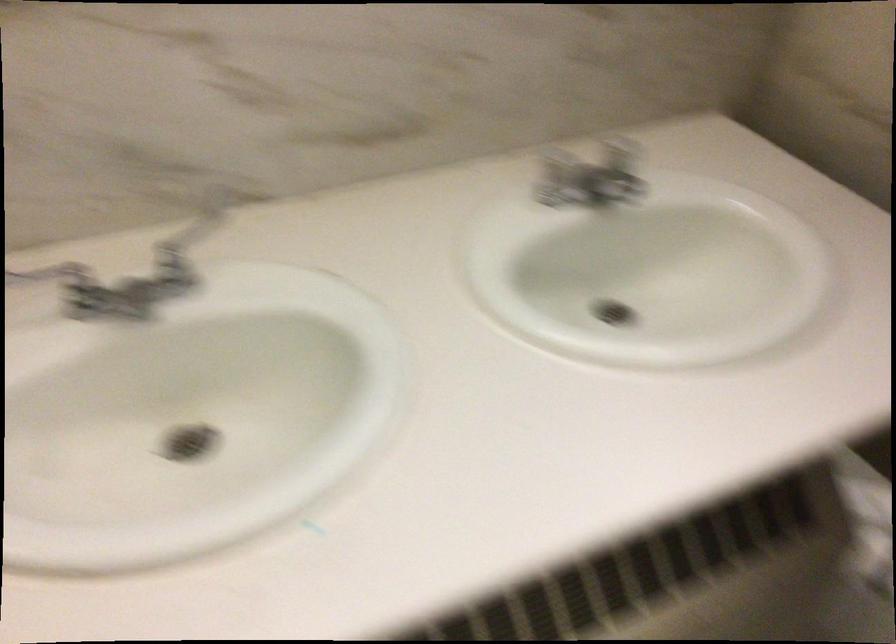
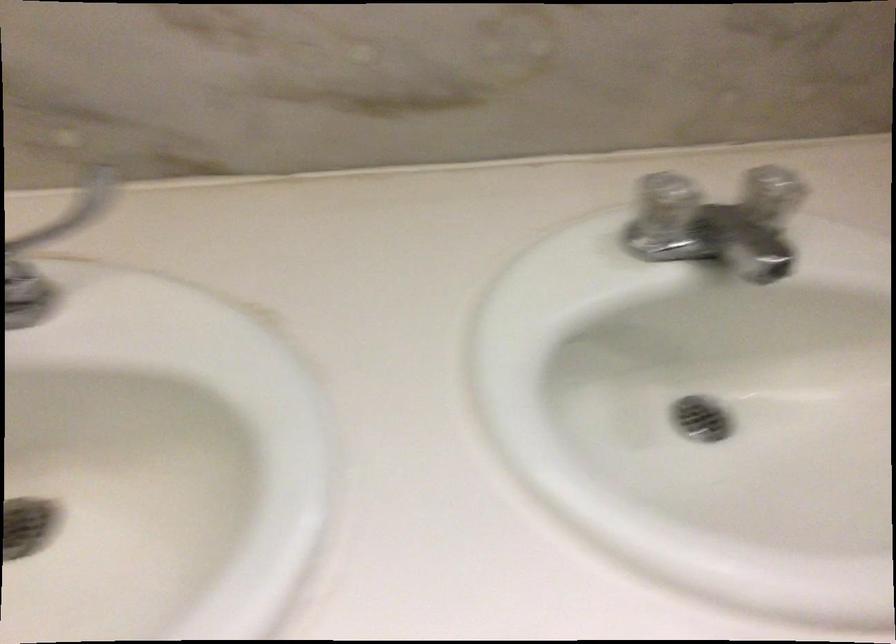
Question: The images are taken continuously from a first-person perspective. In which direction are you moving?

Choices:
 (A) Left
 (B) Right
 (C) Forward
 (D) Backward

Answer: (C)